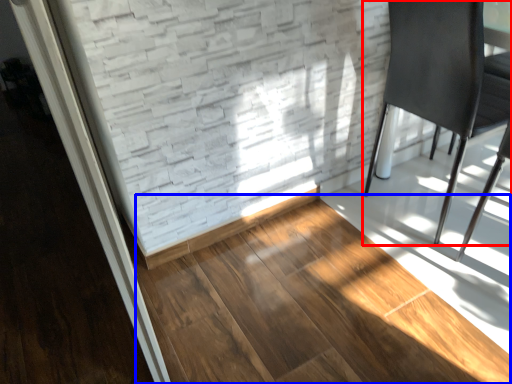
Question: Which point is closer to the camera, chair (highlighted by a red box) or hardwood (highlighted by a blue box)?

Choices:
 (A) chair
 (B) hardwood

Answer: (B)